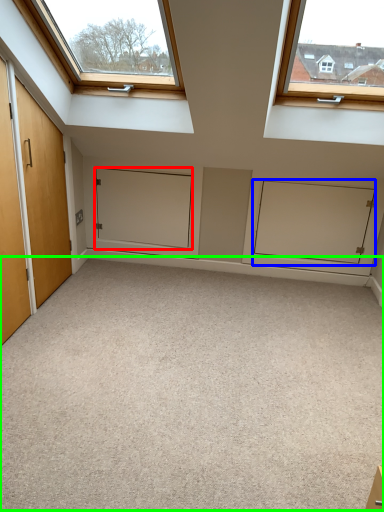
Question: Which object is positioned farthest from door (highlighted by a red box)? Select from cabinetry (highlighted by a blue box) and plain (highlighted by a green box).

Choices:
 (A) cabinetry
 (B) plain

Answer: (B)